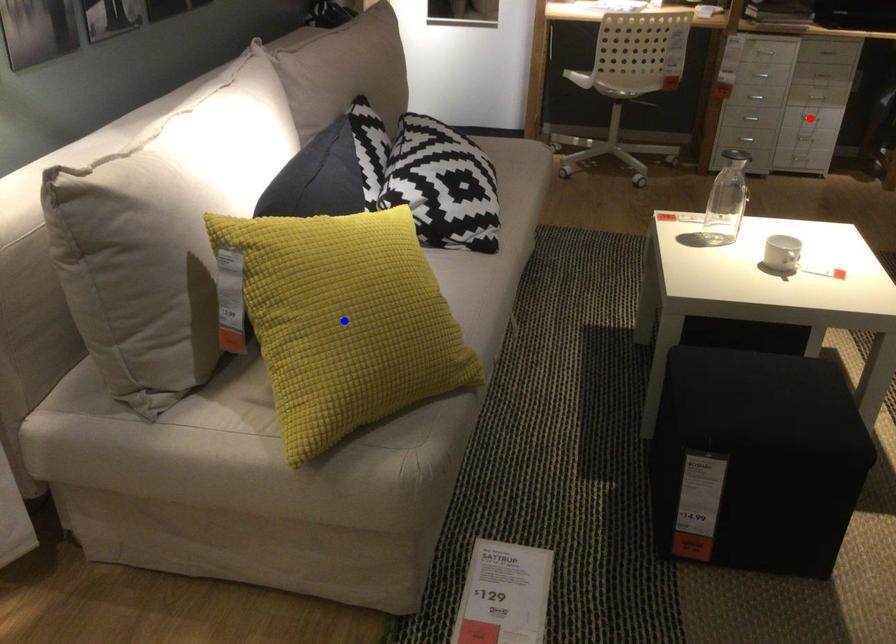
Question: Which of the two points in the image is closer to the camera?

Choices:
 (A) Blue point is closer.
 (B) Red point is closer.

Answer: (A)